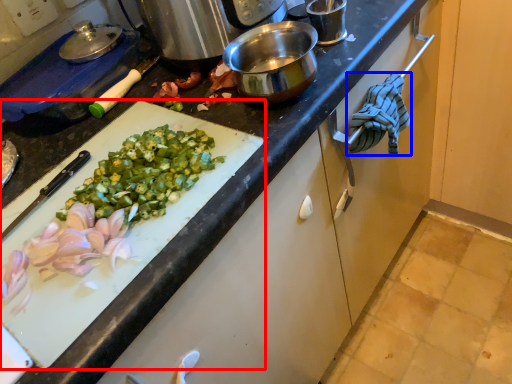
Question: Which point is closer to the camera, cutting board (highlighted by a red box) or cloth (highlighted by a blue box)?

Choices:
 (A) cutting board
 (B) cloth

Answer: (A)